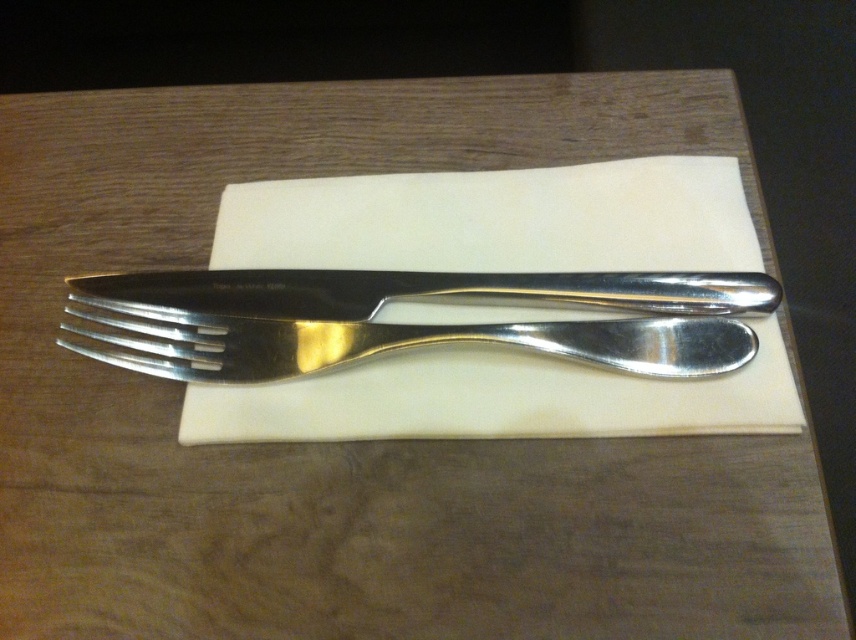
Is white paper napkin at center to the left of polished silver fork at center from the viewer's perspective?

Incorrect, white paper napkin at center is not on the left side of polished silver fork at center.

What do you see at coordinates (497, 220) in the screenshot? The image size is (856, 640). I see `white paper napkin at center` at bounding box center [497, 220].

Is point (389, 259) behind point (100, 298)?

Yes, it is behind point (100, 298).

At what (x,y) coordinates should I click in order to perform the action: click on white paper napkin at center. Please return your answer as a coordinate pair (x, y). This screenshot has height=640, width=856. Looking at the image, I should click on (497, 220).

Measure the distance from polished silver fork at center to polished silver knife at center.

polished silver fork at center is 2.36 centimeters from polished silver knife at center.

This screenshot has width=856, height=640. What do you see at coordinates (381, 340) in the screenshot?
I see `polished silver fork at center` at bounding box center [381, 340].

The height and width of the screenshot is (640, 856). Describe the element at coordinates (381, 340) in the screenshot. I see `polished silver fork at center` at that location.

At what (x,y) coordinates should I click in order to perform the action: click on polished silver fork at center. Please return your answer as a coordinate pair (x, y). Image resolution: width=856 pixels, height=640 pixels. Looking at the image, I should click on (381, 340).

Is white paper napkin at center closer to camera compared to polished silver knife at center?

Yes, white paper napkin at center is in front of polished silver knife at center.

Which is below, white paper napkin at center or polished silver knife at center?

polished silver knife at center is below.

The width and height of the screenshot is (856, 640). Find the location of `white paper napkin at center`. white paper napkin at center is located at coordinates (497, 220).